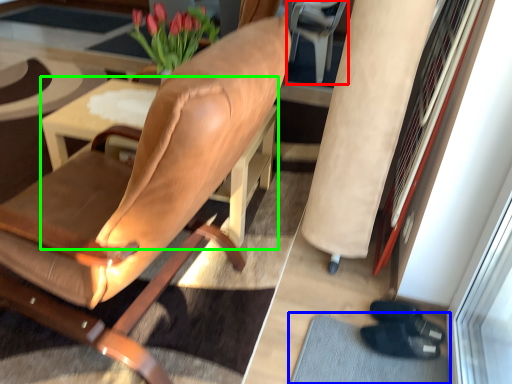
Question: Which object is the farthest from armchair (highlighted by a red box)? Choose among these: doormat (highlighted by a blue box) or table (highlighted by a green box).

Choices:
 (A) doormat
 (B) table

Answer: (A)